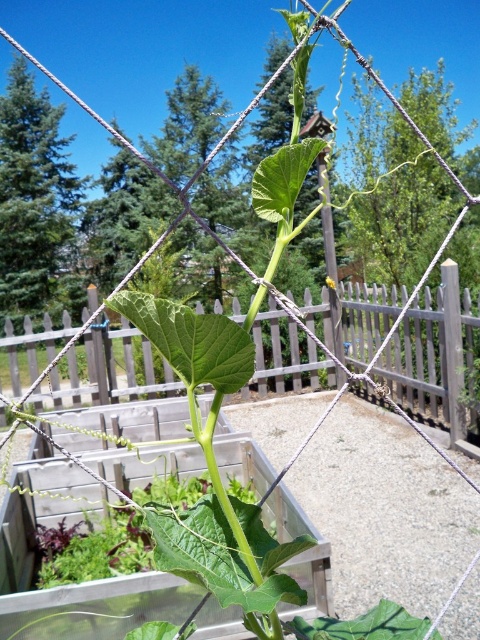
Question: From the image, what is the correct spatial relationship of wooden at center in relation to yellow matte flower at center?

Choices:
 (A) above
 (B) below

Answer: (B)

Question: Is wooden at center wider than yellow matte flower at center?

Choices:
 (A) yes
 (B) no

Answer: (A)

Question: Does wooden at center appear on the right side of yellow matte flower at center?

Choices:
 (A) yes
 (B) no

Answer: (A)

Question: Which object appears farthest from the camera in this image?

Choices:
 (A) wooden at center
 (B) yellow matte flower at center

Answer: (B)